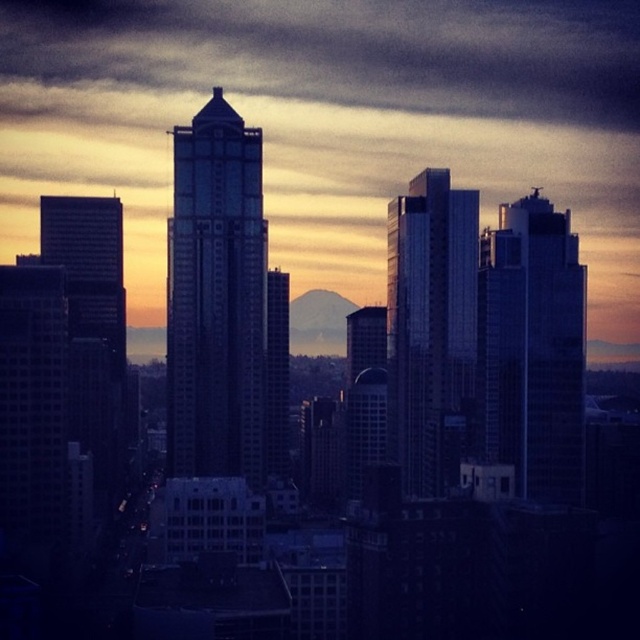
Question: Which of the following is the farthest from the observer?

Choices:
 (A) glassy reflective skyscraper at center
 (B) glossy glass skyscraper at center
 (C) sleek glass skyscraper at right

Answer: (C)

Question: Based on their relative distances, which object is nearer to the glassy reflective skyscraper at center?

Choices:
 (A) glossy glass skyscraper at center
 (B) sleek glass skyscraper at right

Answer: (A)

Question: Does sleek glass skyscraper at right appear on the right side of glossy glass skyscraper at center?

Choices:
 (A) yes
 (B) no

Answer: (A)

Question: Does sleek glass skyscraper at right appear over glossy glass skyscraper at center?

Choices:
 (A) yes
 (B) no

Answer: (B)

Question: Does glassy reflective skyscraper at center have a larger size compared to sleek glass skyscraper at right?

Choices:
 (A) no
 (B) yes

Answer: (A)

Question: Which object appears closest to the camera in this image?

Choices:
 (A) glassy reflective skyscraper at center
 (B) sleek glass skyscraper at right
 (C) glossy glass skyscraper at center

Answer: (A)